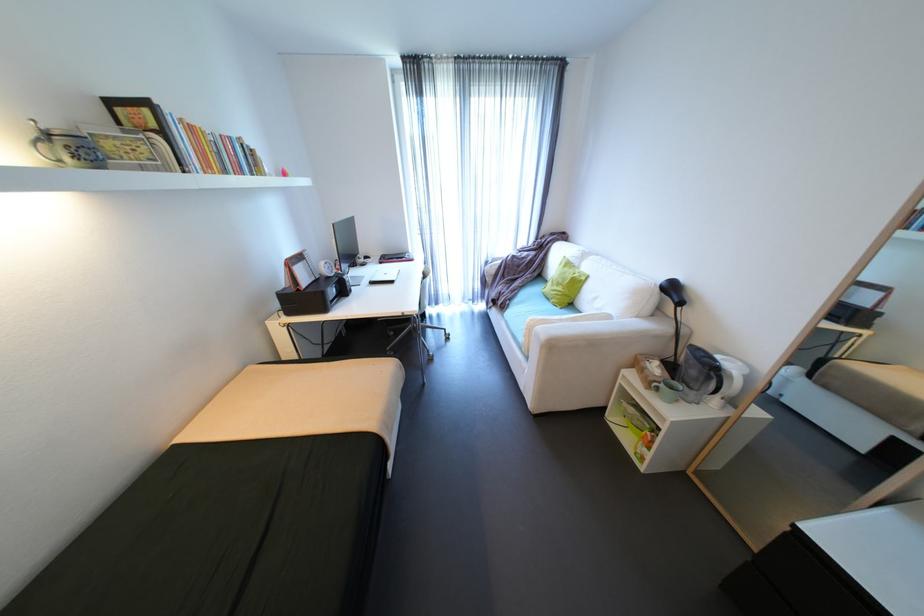
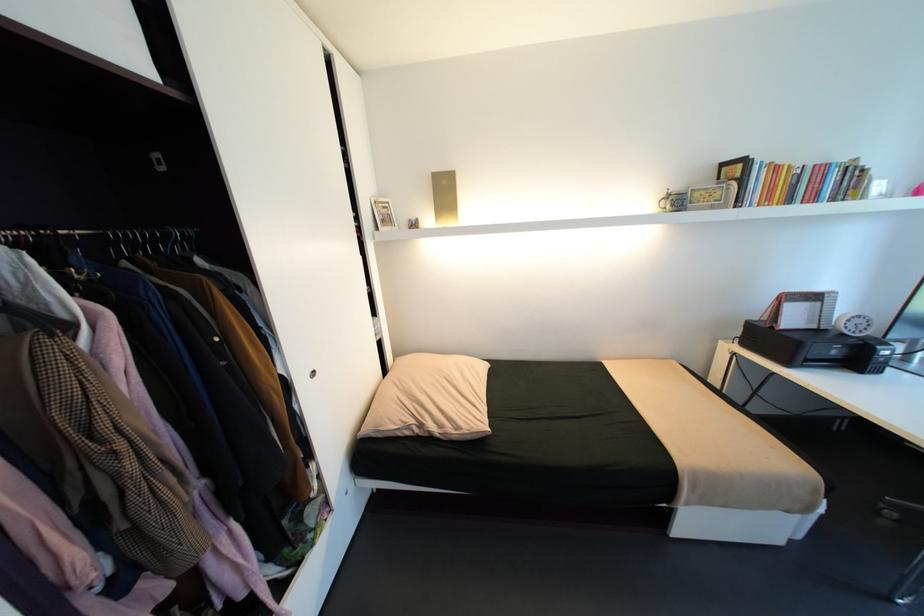
In the second image, find the point that corresponds to pixel 306 290 in the first image.

(779, 328)